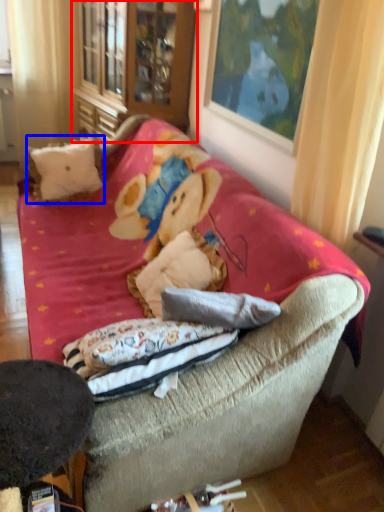
Question: Which object appears farthest to the camera in this image, armoire (highlighted by a red box) or throw pillow (highlighted by a blue box)?

Choices:
 (A) armoire
 (B) throw pillow

Answer: (A)